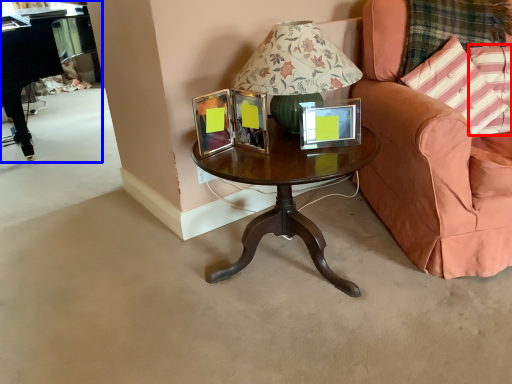
Question: Which object appears closest to the camera in this image, pillow (highlighted by a red box) or piano (highlighted by a blue box)?

Choices:
 (A) pillow
 (B) piano

Answer: (A)